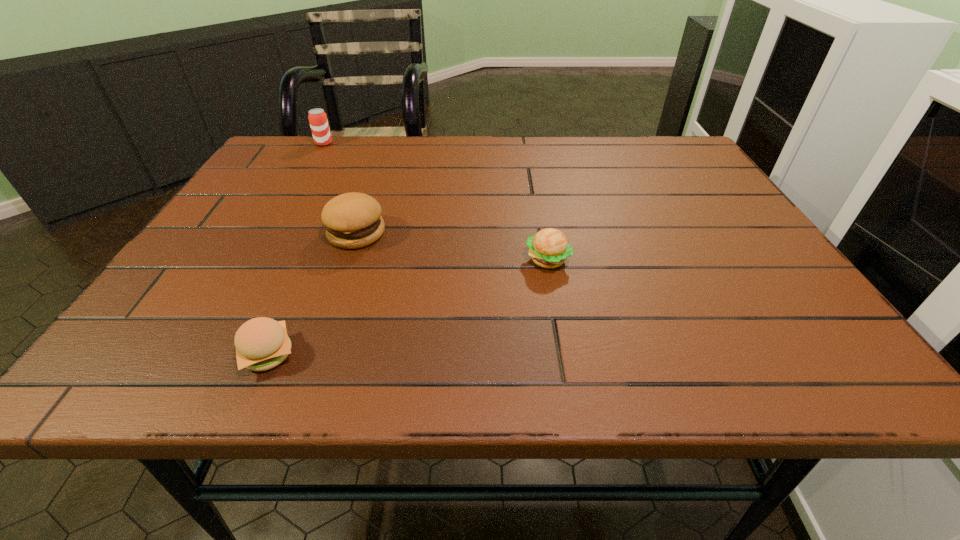
Image resolution: width=960 pixels, height=540 pixels. I want to click on object at the near edge, so point(262,343).

Locate an element on the screen. object that is at the left edge is located at coordinates (317, 117).

Locate an element on the screen. The width and height of the screenshot is (960, 540). object that is at the far left corner is located at coordinates (317, 117).

In the image, there is a desktop. Where is `free space at the far edge`? This screenshot has height=540, width=960. free space at the far edge is located at coordinates (360, 164).

The width and height of the screenshot is (960, 540). I want to click on free space at the left edge of the desktop, so click(271, 230).

The image size is (960, 540). Identify the location of vacant space at the right edge. (737, 222).

In the image, there is a desktop. What are the coordinates of `free space at the near left corner` in the screenshot? It's located at (171, 373).

The height and width of the screenshot is (540, 960). Find the location of `vacant area at the far right corner`. vacant area at the far right corner is located at coordinates (668, 169).

Where is `vacant area at the near right corner`? vacant area at the near right corner is located at coordinates (819, 371).

The height and width of the screenshot is (540, 960). Find the location of `vacant region between the rightmost object and the tallest hamburger`. vacant region between the rightmost object and the tallest hamburger is located at coordinates (452, 246).